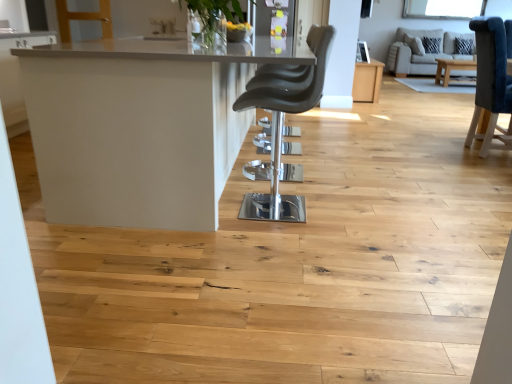
What do you see at coordinates (140, 127) in the screenshot? I see `white glossy table at center, which ranks as the 1th table in left-to-right order` at bounding box center [140, 127].

The height and width of the screenshot is (384, 512). I want to click on beige fabric couch at upper right, so click(423, 51).

Considering the sizes of objects light brown wood table at center, which ranks as the 1th table in top-to-bottom order, and matte black chair at center in the image provided, who is taller, light brown wood table at center, which ranks as the 1th table in top-to-bottom order, or matte black chair at center?

Standing taller between the two is matte black chair at center.

Which object is closer to the camera, light brown wood table at center, which ranks as the 1th table in top-to-bottom order, or matte black chair at center?

matte black chair at center is in front.

From the picture: Can you confirm if light brown wood table at center, positioned as the second table in bottom-to-top order, is positioned to the right of matte black chair at center?

Yes.

Which is farther from the camera, (369,63) or (298,205)?

The point (369,63) is behind.

Would you say white glossy table at center, the 1th table in the bottom-to-top sequence, is a long distance from light brown wood table at center, positioned as the second table in bottom-to-top order?

Yes, white glossy table at center, the 1th table in the bottom-to-top sequence, and light brown wood table at center, positioned as the second table in bottom-to-top order, are quite far apart.

From a real-world perspective, who is located higher, white glossy table at center, positioned as the 1th table in front-to-back order, or light brown wood table at center, marked as the 2th table in a front-to-back arrangement?

From a 3D spatial view, white glossy table at center, positioned as the 1th table in front-to-back order, is above.

Does white glossy table at center, which ranks as the 1th table in left-to-right order, turn towards light brown wood table at center, marked as the 2th table in a front-to-back arrangement?

No, white glossy table at center, which ranks as the 1th table in left-to-right order, does not turn towards light brown wood table at center, marked as the 2th table in a front-to-back arrangement.

In terms of width, does white glossy table at center, which is the second table from right to left, look wider or thinner when compared to light brown wood table at center, arranged as the 1th table when viewed from the right?

Clearly, white glossy table at center, which is the second table from right to left, has more width compared to light brown wood table at center, arranged as the 1th table when viewed from the right.

Are clear glass window screen at upper center and beige fabric couch at upper right located far from each other?

They are positioned close to each other.

Is clear glass window screen at upper center to the left of beige fabric couch at upper right from the viewer's perspective?

No.

Considering the sizes of clear glass window screen at upper center and beige fabric couch at upper right in the image, is clear glass window screen at upper center taller or shorter than beige fabric couch at upper right?

In the image, clear glass window screen at upper center appears to be shorter than beige fabric couch at upper right.

From a real-world perspective, which is physically below, clear glass window screen at upper center or light brown wood table at center, which ranks as the 1th table in top-to-bottom order?

light brown wood table at center, which ranks as the 1th table in top-to-bottom order.

Consider the image. Which object is closer to the camera taking this photo, clear glass window screen at upper center or light brown wood table at center, the second table positioned from the left?

light brown wood table at center, the second table positioned from the left.

Are clear glass window screen at upper center and light brown wood table at center, arranged as the 1th table when viewed from the right, making contact?

clear glass window screen at upper center is not next to light brown wood table at center, arranged as the 1th table when viewed from the right, and they're not touching.

Consider the image. Which is closer to the camera, [420,4] or [375,65]?

The point [375,65] is closer to the camera.

Is light brown wood table at center, the first table in the back-to-front sequence, at the left side of white glossy table at center, positioned as the 1th table in front-to-back order?

No.

Who is taller, light brown wood table at center, the first table in the back-to-front sequence, or white glossy table at center, which ranks as the 1th table in left-to-right order?

white glossy table at center, which ranks as the 1th table in left-to-right order, is taller.

From a real-world perspective, is light brown wood table at center, which ranks as the 1th table in top-to-bottom order, positioned above or below white glossy table at center, the 1th table in the bottom-to-top sequence?

light brown wood table at center, which ranks as the 1th table in top-to-bottom order, is situated lower than white glossy table at center, the 1th table in the bottom-to-top sequence, in the real world.

Considering the sizes of light brown wood table at center, arranged as the 1th table when viewed from the right, and white glossy table at center, which is the second table from back to front, in the image, is light brown wood table at center, arranged as the 1th table when viewed from the right, wider or thinner than white glossy table at center, which is the second table from back to front,?

light brown wood table at center, arranged as the 1th table when viewed from the right, is thinner than white glossy table at center, which is the second table from back to front.

Is matte black chair at center smaller than white glossy table at center, which ranks as the 1th table in left-to-right order?

Correct, matte black chair at center occupies less space than white glossy table at center, which ranks as the 1th table in left-to-right order.

Is matte black chair at center touching white glossy table at center, the 1th table in the bottom-to-top sequence?

No, matte black chair at center is not beside white glossy table at center, the 1th table in the bottom-to-top sequence.

How far apart are matte black chair at center and white glossy table at center, which is the second table from back to front?

matte black chair at center is 26.53 inches away from white glossy table at center, which is the second table from back to front.

Considering the relative sizes of matte black chair at center and white glossy table at center, which ranks as the 1th table in left-to-right order, in the image provided, is matte black chair at center thinner than white glossy table at center, which ranks as the 1th table in left-to-right order,?

Yes, matte black chair at center is thinner than white glossy table at center, which ranks as the 1th table in left-to-right order.

This screenshot has height=384, width=512. Find the location of `table that is the 2nd object located in front of the beige fabric couch at upper right`. table that is the 2nd object located in front of the beige fabric couch at upper right is located at coordinates (140, 127).

Considering the relative sizes of beige fabric couch at upper right and white glossy table at center, which ranks as the 1th table in left-to-right order, in the image provided, is beige fabric couch at upper right thinner than white glossy table at center, which ranks as the 1th table in left-to-right order,?

Correct, the width of beige fabric couch at upper right is less than that of white glossy table at center, which ranks as the 1th table in left-to-right order.

Does beige fabric couch at upper right come in front of white glossy table at center, which ranks as the 1th table in left-to-right order?

That is False.

Find the location of a particular element. The image size is (512, 384). table behind the matte black chair at center is located at coordinates (367, 81).

Identify the location of table above the light brown wood table at center, positioned as the second table in bottom-to-top order (from a real-world perspective). (140, 127).

From the picture: Considering their positions, is beige fabric couch at upper right positioned closer to clear glass window screen at upper center than matte black chair at center?

Based on the image, beige fabric couch at upper right appears to be nearer to clear glass window screen at upper center.

Estimate the real-world distances between objects in this image. Which object is closer to matte black chair at center, beige fabric couch at upper right or light brown wood table at center, which ranks as the 1th table in top-to-bottom order?

Among the two, light brown wood table at center, which ranks as the 1th table in top-to-bottom order, is located nearer to matte black chair at center.

In the scene shown: From the image, which object appears to be farther from matte black chair at center, clear glass window screen at upper center or beige fabric couch at upper right?

clear glass window screen at upper center is further to matte black chair at center.

Based on their spatial positions, is light brown wood table at center, the second table positioned from the left, or white glossy table at center, which ranks as the 1th table in left-to-right order, further from matte black chair at center?

Among the two, light brown wood table at center, the second table positioned from the left, is located further to matte black chair at center.

Considering their positions, is clear glass window screen at upper center positioned closer to beige fabric couch at upper right than white glossy table at center, the 2th table viewed from the top?

The object closer to beige fabric couch at upper right is clear glass window screen at upper center.

Considering their positions, is clear glass window screen at upper center positioned further to matte black chair at center than white glossy table at center, which is the second table from back to front?

clear glass window screen at upper center lies further to matte black chair at center than the other object.

Based on their spatial positions, is matte black chair at center or beige fabric couch at upper right further from clear glass window screen at upper center?

Among the two, matte black chair at center is located further to clear glass window screen at upper center.

When comparing their distances from white glossy table at center, which is the second table from back to front, does light brown wood table at center, the first table in the back-to-front sequence, or beige fabric couch at upper right seem closer?

Among the two, light brown wood table at center, the first table in the back-to-front sequence, is located nearer to white glossy table at center, which is the second table from back to front.

In order to click on chair between white glossy table at center, positioned as the 1th table in front-to-back order, and clear glass window screen at upper center from front to back in this screenshot , I will do coord(281,140).

The width and height of the screenshot is (512, 384). Identify the location of table between matte black chair at center and beige fabric couch at upper right from front to back. coord(367,81).

Where is `couch between matte black chair at center and clear glass window screen at upper center in the front-back direction`? couch between matte black chair at center and clear glass window screen at upper center in the front-back direction is located at coordinates (423, 51).

Locate an element on the screen. This screenshot has height=384, width=512. couch positioned between light brown wood table at center, positioned as the second table in bottom-to-top order, and clear glass window screen at upper center from near to far is located at coordinates (423, 51).